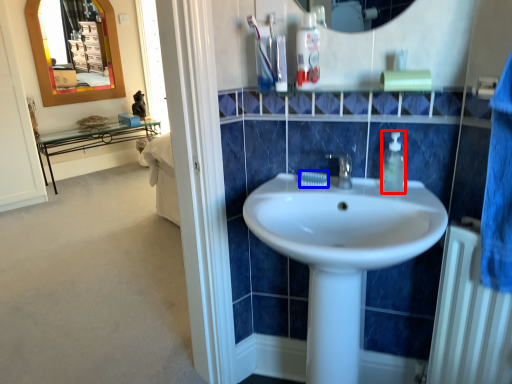
Question: Which of the following is the farthest to the observer, soap dispenser (highlighted by a red box) or toothpaste (highlighted by a blue box)?

Choices:
 (A) soap dispenser
 (B) toothpaste

Answer: (B)